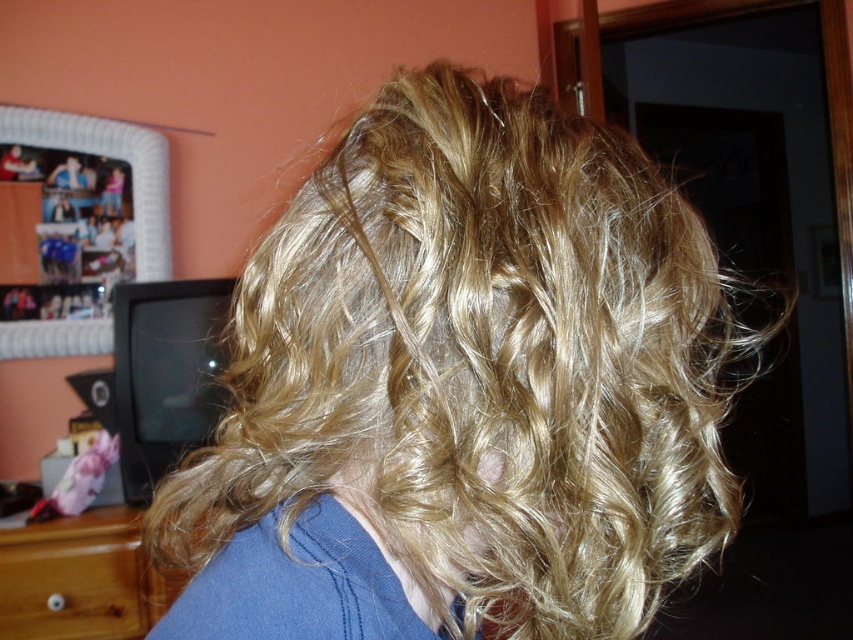
Who is taller, blonde curly hair at center or wooden dresser at lower left?

blonde curly hair at center

Who is positioned more to the right, blonde curly hair at center or wooden dresser at lower left?

Positioned to the right is blonde curly hair at center.

Measure the distance between blonde curly hair at center and camera.

blonde curly hair at center and camera are 12.16 inches apart.

The width and height of the screenshot is (853, 640). I want to click on blonde curly hair at center, so click(x=461, y=388).